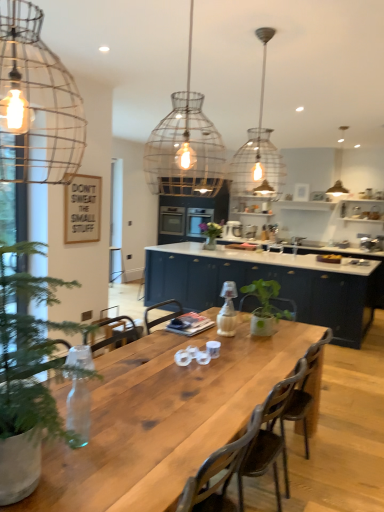
Question: Is green matte vase at center wider than wire mesh pendant light at upper left, marked as the 3th lamp in a back-to-front arrangement?

Choices:
 (A) yes
 (B) no

Answer: (A)

Question: From the image's perspective, would you say green matte vase at center is shown under wire mesh pendant light at upper left, which is the first lamp in front-to-back order?

Choices:
 (A) yes
 (B) no

Answer: (A)

Question: Would you say green matte vase at center is a long distance from wire mesh pendant light at upper left, placed as the first lamp when sorted from left to right?

Choices:
 (A) yes
 (B) no

Answer: (A)

Question: Is green matte vase at center oriented away from wire mesh pendant light at upper left, which is the 3th lamp in right-to-left order?

Choices:
 (A) no
 (B) yes

Answer: (A)

Question: Is green matte vase at center further to the viewer compared to wire mesh pendant light at upper left, which is the 3th lamp in right-to-left order?

Choices:
 (A) yes
 (B) no

Answer: (A)

Question: Does point (266, 169) appear closer or farther from the camera than point (334, 165)?

Choices:
 (A) closer
 (B) farther

Answer: (A)

Question: Looking at their shapes, would you say clear glass pendant light at upper center, the 2th lamp viewed from the back, is wider or thinner than matte glass pendant light at upper right, the first lamp positioned from the right?

Choices:
 (A) wide
 (B) thin

Answer: (A)

Question: Is clear glass pendant light at upper center, marked as the 2th lamp in a front-to-back arrangement, bigger or smaller than matte glass pendant light at upper right, which is the third lamp in left-to-right order?

Choices:
 (A) big
 (B) small

Answer: (A)

Question: Do you think clear glass pendant light at upper center, marked as the 2th lamp in a front-to-back arrangement, is within matte glass pendant light at upper right, which is the third lamp in left-to-right order, or outside of it?

Choices:
 (A) outside
 (B) inside

Answer: (A)

Question: Relative to natural wood table at center, is wire mesh pendant light at upper left, which is the 3th lamp in right-to-left order, in front or behind?

Choices:
 (A) front
 (B) behind

Answer: (A)

Question: Would you say wire mesh pendant light at upper left, marked as the 3th lamp in a back-to-front arrangement, is to the left or to the right of natural wood table at center in the picture?

Choices:
 (A) left
 (B) right

Answer: (A)

Question: Is wire mesh pendant light at upper left, which is the 3th lamp in right-to-left order, taller or shorter than natural wood table at center?

Choices:
 (A) short
 (B) tall

Answer: (A)

Question: From a real-world perspective, is wire mesh pendant light at upper left, which is the 3th lamp in right-to-left order, positioned above or below natural wood table at center?

Choices:
 (A) above
 (B) below

Answer: (A)

Question: Based on their positions, is green matte vase at center located to the left or right of matte blue cabinets at center?

Choices:
 (A) left
 (B) right

Answer: (A)

Question: From a real-world perspective, is green matte vase at center positioned above or below matte blue cabinets at center?

Choices:
 (A) above
 (B) below

Answer: (A)